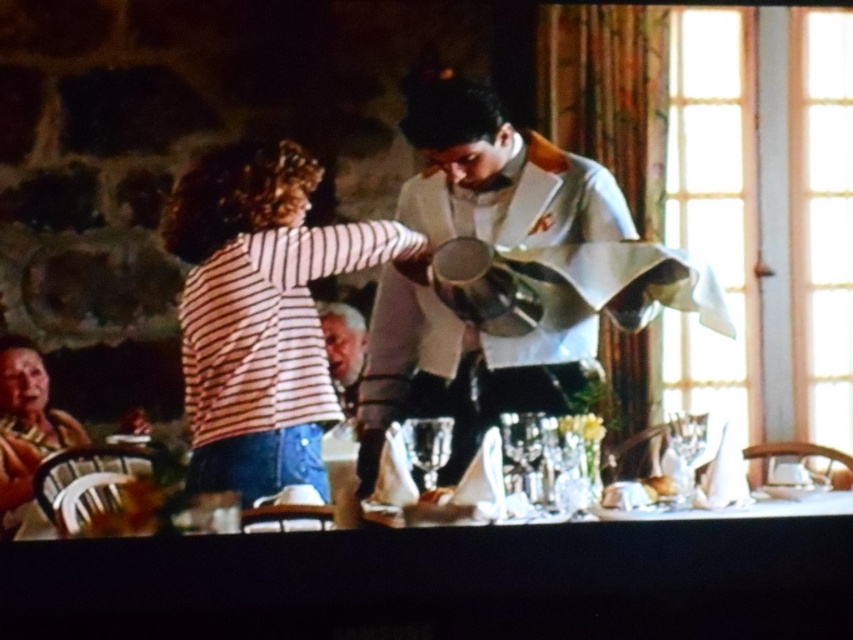
You are a guest at this rustic dining table. You need to pour water into the clear glass wine glass at center using the metallic silver pitcher at center. Can the pitcher pour water into the glass without spilling? Explain why.

The metallic silver pitcher at center has a larger size compared to clear glass wine glass at center. Since the pitcher is larger, it can pour water into the glass without spilling as long as you control the flow carefully.

You are a guest at this rustic dining table. You want to hand a menu to the person wearing the striped fabric shirt at center without touching the metallic silver pitcher at center. How should you position your hand to avoid the pitcher?

The striped fabric shirt at center is behind the metallic silver pitcher at center, so you should position your hand behind the metallic silver pitcher at center to reach the person without touching the pitcher.